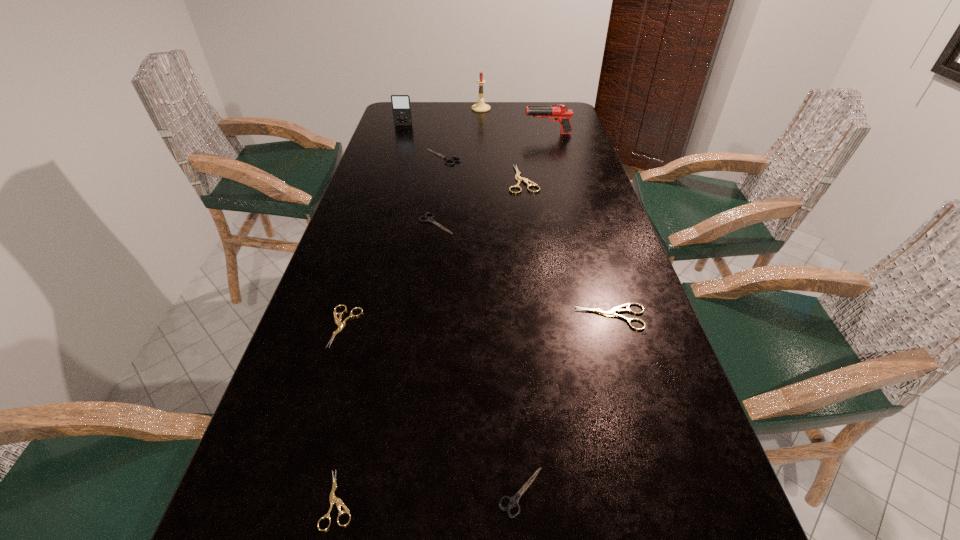
Locate an element on the screen. Image resolution: width=960 pixels, height=540 pixels. vacant area between the second farthest object and the farthest object is located at coordinates (443, 117).

Locate an element on the screen. The width and height of the screenshot is (960, 540). unoccupied position between the farthest object and the second smallest black shears is located at coordinates (459, 166).

Where is `vacant area that lies between the rightmost black shears and the iPod`? vacant area that lies between the rightmost black shears and the iPod is located at coordinates (463, 308).

Where is `free space between the shortest shears and the second beige shears from right to left`? Image resolution: width=960 pixels, height=540 pixels. free space between the shortest shears and the second beige shears from right to left is located at coordinates (431, 339).

Identify the location of unoccupied area between the tallest object and the rightmost black shears. (501, 300).

Find the location of a particular element. This screenshot has height=540, width=960. unoccupied area between the shortest shears and the second smallest beige shears is located at coordinates (342, 413).

Image resolution: width=960 pixels, height=540 pixels. In order to click on free area in between the tallest object and the third beige shears from left to right in this screenshot , I will do `click(502, 144)`.

Identify the location of free area in between the second farthest object and the second beige shears from right to left. The height and width of the screenshot is (540, 960). (464, 152).

This screenshot has width=960, height=540. In order to click on the sixth closest object relative to the smallest black shears in this screenshot , I will do `click(446, 158)`.

Identify the location of the eighth closest object to the farthest object. (513, 501).